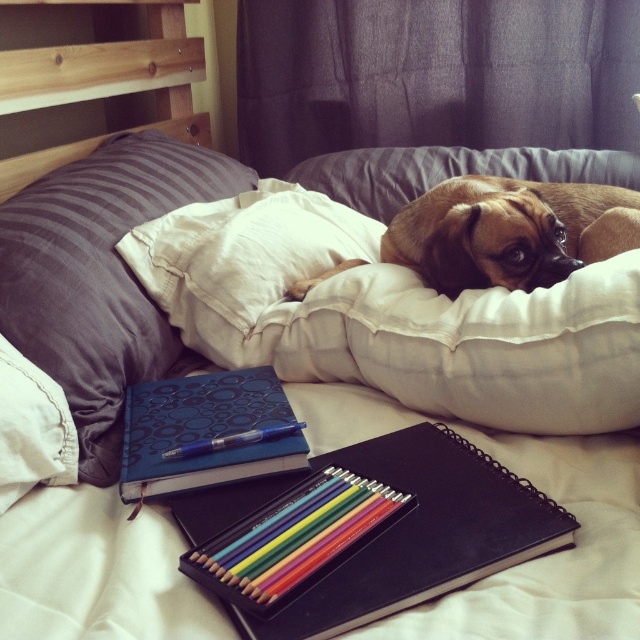
Question: Which of these objects is positioned farthest from the brown fur dog at center?

Choices:
 (A) blue metallic pen at center
 (B) blue textured notebook at center
 (C) blue fabric pillow at left
 (D) black matte notebook at center

Answer: (C)

Question: Is matte wooden pencils at center wider than blue metallic pen at center?

Choices:
 (A) yes
 (B) no

Answer: (A)

Question: Where is black matte notebook at center located in relation to matte wooden pencils at center in the image?

Choices:
 (A) above
 (B) below

Answer: (A)

Question: From the image, what is the correct spatial relationship of brown fur dog at center in relation to blue metallic pen at center?

Choices:
 (A) left
 (B) right

Answer: (B)

Question: Estimate the real-world distances between objects in this image. Which object is farther from the blue metallic pen at center?

Choices:
 (A) black matte notebook at center
 (B) blue fabric pillow at left
 (C) blue textured notebook at center
 (D) matte wooden pencils at center

Answer: (B)

Question: Among these points, which one is farthest from the camera?

Choices:
 (A) (637, 209)
 (B) (252, 442)

Answer: (A)